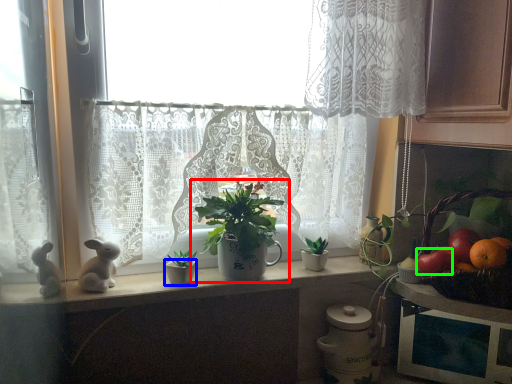
Question: Estimate the real-world distances between objects in this image. Which object is closer to houseplant (highlighted by a red box), flowerpot (highlighted by a blue box) or fruit (highlighted by a green box)?

Choices:
 (A) flowerpot
 (B) fruit

Answer: (A)